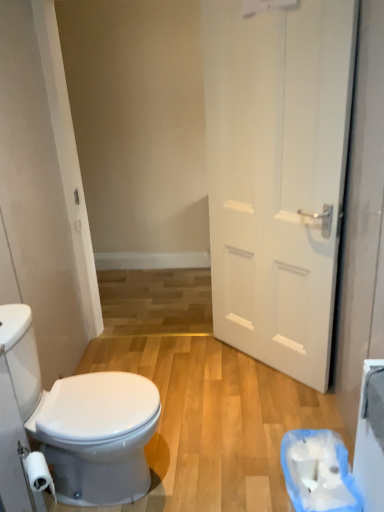
The width and height of the screenshot is (384, 512). Find the location of `vacant region to the left of white matte door at right`. vacant region to the left of white matte door at right is located at coordinates (195, 378).